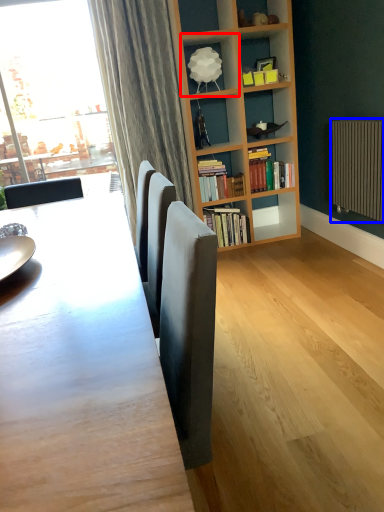
Question: Which of the following is the closest to the observer, shelf (highlighted by a red box) or radiator (highlighted by a blue box)?

Choices:
 (A) shelf
 (B) radiator

Answer: (B)